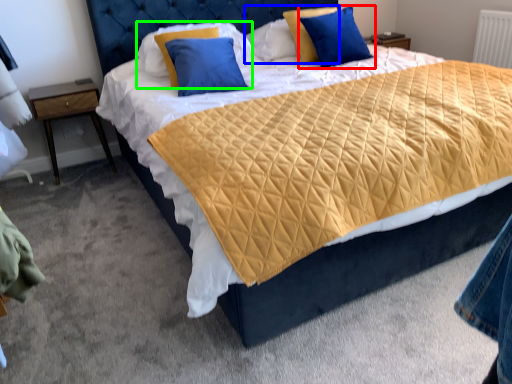
Question: Which object is the farthest from pillow (highlighted by a red box)? Choose among these: pillow (highlighted by a blue box) or pillow (highlighted by a green box).

Choices:
 (A) pillow
 (B) pillow

Answer: (B)